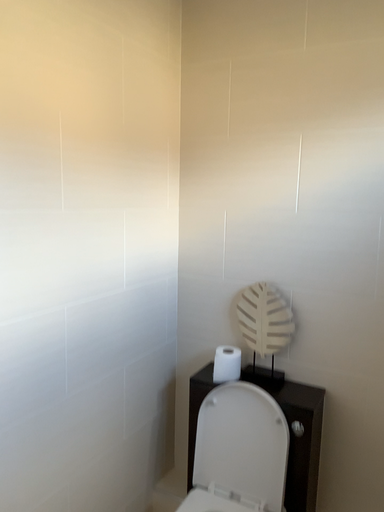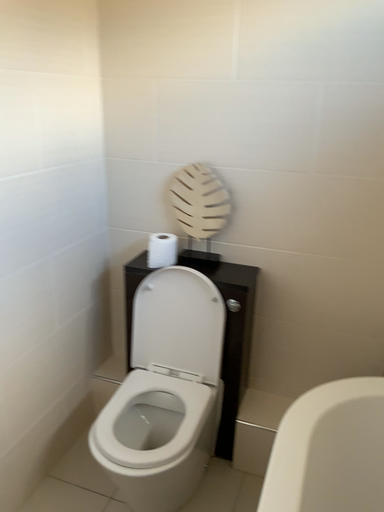
Question: Which way did the camera rotate in the video?

Choices:
 (A) rotated upward
 (B) rotated downward

Answer: (B)